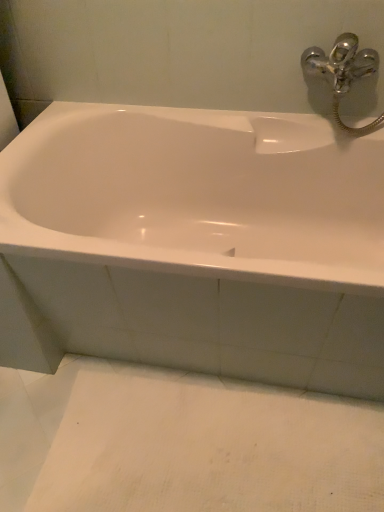
This screenshot has height=512, width=384. What are the coordinates of `white glossy bathtub at center` in the screenshot? It's located at 197,194.

This screenshot has height=512, width=384. Describe the element at coordinates (197, 194) in the screenshot. I see `white glossy bathtub at center` at that location.

You are a GUI agent. You are given a task and a screenshot of the screen. Output one action in this format:
    pyautogui.click(x=<x>, y=<y>)
    Task: Click on the white glossy bathtub at center
    The width and height of the screenshot is (384, 512).
    Given the screenshot: What is the action you would take?
    pyautogui.click(x=197, y=194)